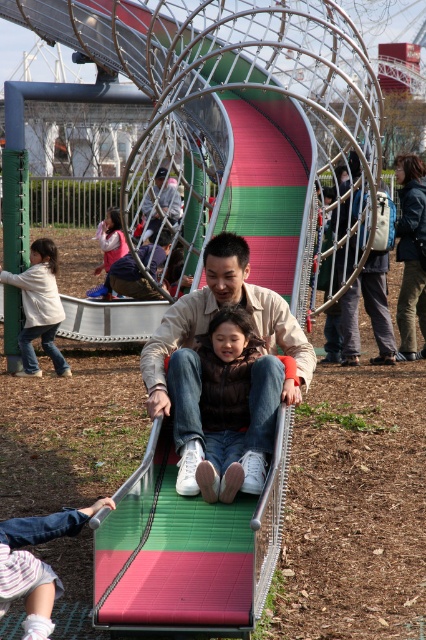
Between white cotton shirt at left and matte pink jacket at lower left, which one is positioned higher?

matte pink jacket at lower left is above.

Find the location of a particular element. Image resolution: width=426 pixels, height=640 pixels. white cotton shirt at left is located at coordinates (39, 307).

How much distance is there between striped fabric pants at lower left and matte silver slide at center?

They are 13.60 meters apart.

Is striped fabric pants at lower left positioned before matte silver slide at center?

Yes, it is.

Where is `striped fabric pants at lower left`? The width and height of the screenshot is (426, 640). striped fabric pants at lower left is located at coordinates (37, 563).

This screenshot has height=640, width=426. In order to click on striped fabric pants at lower left in this screenshot , I will do `click(37, 563)`.

What do you see at coordinates (37, 563) in the screenshot? I see `striped fabric pants at lower left` at bounding box center [37, 563].

Locate an element on the screen. striped fabric pants at lower left is located at coordinates (37, 563).